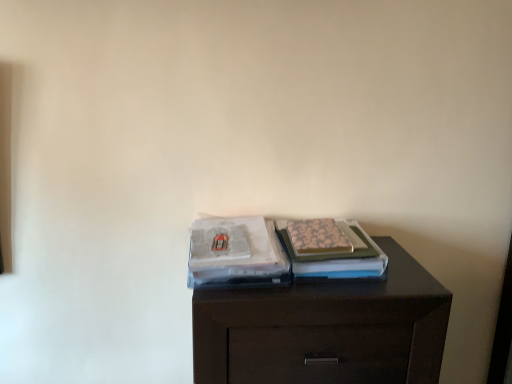
Question: Based on their sizes in the image, would you say dark wood chest of drawers at center is bigger or smaller than matte plastic magazine at center, which is the first magazine from left to right?

Choices:
 (A) big
 (B) small

Answer: (A)

Question: From their relative heights in the image, would you say dark wood chest of drawers at center is taller or shorter than matte plastic magazine at center, the 2th magazine from the right?

Choices:
 (A) tall
 (B) short

Answer: (A)

Question: Which object is the closest to the matte plastic magazine at center, the 2th magazine from the right?

Choices:
 (A) patterned paper magazine at center, which ranks as the 2th magazine in left-to-right order
 (B) dark wood chest of drawers at center

Answer: (A)

Question: Considering the real-world distances, which object is farthest from the dark wood chest of drawers at center?

Choices:
 (A) matte plastic magazine at center, the 2th magazine from the right
 (B) patterned paper magazine at center, which ranks as the first magazine in right-to-left order

Answer: (A)